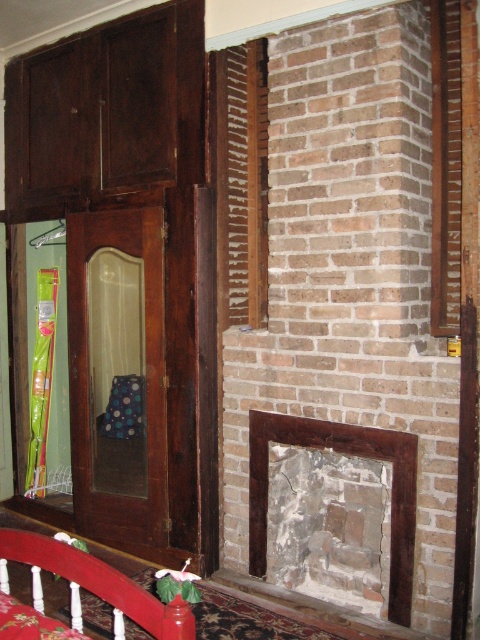
You are standing in the room and want to hang a picture frame that requires a hook placed at a height of 2 meters. Given the wooden slats at center and the red wood bed rail at lower left, which object would be suitable for hanging the frame?

The wooden slats at center is much taller than the red wood bed rail at lower left, so the wooden slats at center would be suitable for hanging the picture frame at 2 meters height.

You are standing in the room and want to move from the point at coordinates point (233, 268) to the point at coordinates point (411, 504). Which direction should you move in to get closer to your destination?

To move from point (233, 268) to point (411, 504), you should move towards the right and upwards since point (411, 504) is located to the right and above point (233, 268).

A person is standing at point A located at coordinates point [259,285]. They want to throw a ball to their friend who is standing at point B. If the maximum distance they can throw is 3 meters, will the ball reach their friend?

The distance between the two points is 3.40 meters, which is greater than the maximum throwing distance of 3 meters. Therefore, the ball will not reach their friend.